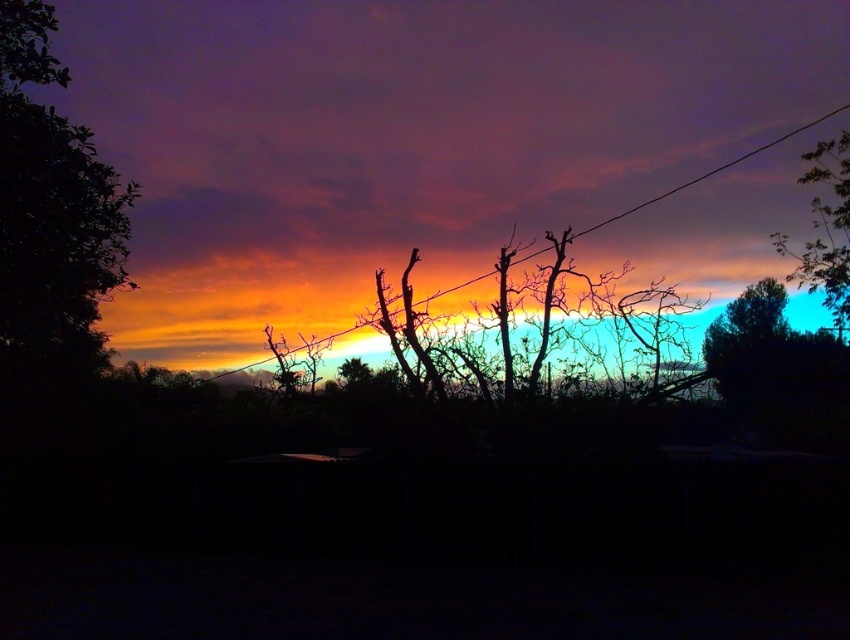
You are an astronomer observing the sunset scene. You notice the green leafy tree at left. Where exactly is it located in the image?

The green leafy tree at left is located at point coordinates of (51, 216).

You are an artist trying to paint the sunset scene. You notice the green leafy tree at upper right and the orange matte power line at center. Which object is positioned higher in the image?

The green leafy tree at upper right is positioned higher than the orange matte power line at center.

You are an artist trying to paint the sunset scene. You want to ensure the green leafy tree at upper right and the orange matte power line at center are positioned correctly in terms of depth. Based on the scene, which object should appear in front of the other?

The green leafy tree at upper right should appear in front of the orange matte power line at center because it is closer to the viewer.